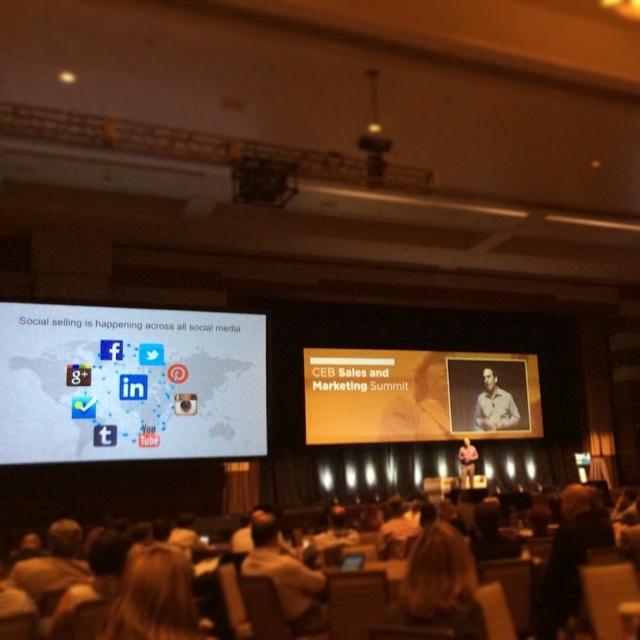
You are an event photographer at the CEB Sales and Marketing Summit. You need to capture a photo that includes both the orange matte projection screen at center and the light brown leather jacket at lower center. Based on their sizes, which object will appear larger in the photo?

The orange matte projection screen at center will appear larger in the photo because it is much taller than the light brown leather jacket at lower center.